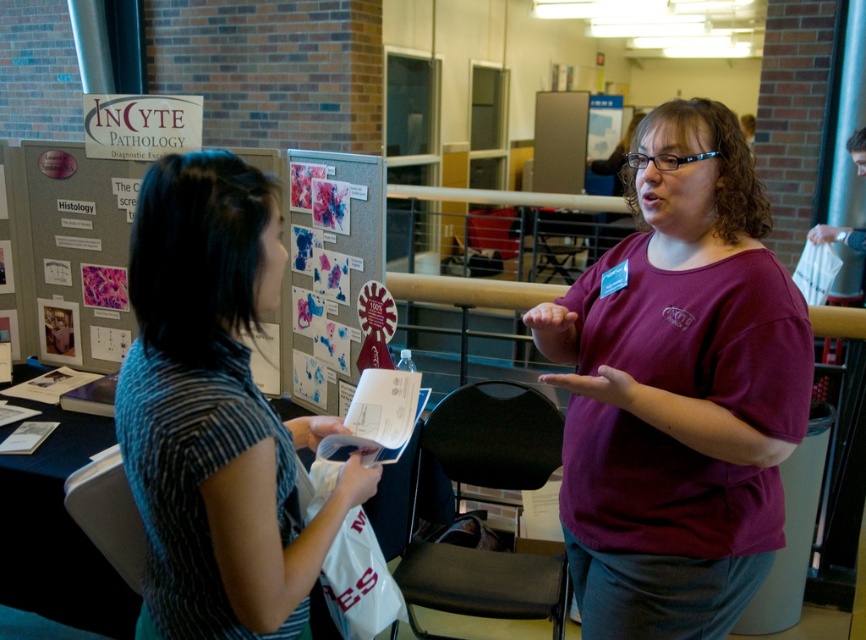
Question: From the image, what is the correct spatial relationship of striped fabric shirt at center in relation to watercolor paper poster at center?

Choices:
 (A) left
 (B) right

Answer: (B)

Question: Which point is closer to the camera taking this photo?

Choices:
 (A) (95, 170)
 (B) (225, 256)
 (C) (375, 186)

Answer: (B)

Question: Which point appears farthest from the camera in this image?

Choices:
 (A) (677, 225)
 (B) (104, 278)
 (C) (301, 333)
 (D) (173, 624)

Answer: (B)

Question: Which of these objects is positioned closest to the watercolor paper poster at center?

Choices:
 (A) maroon t-shirt at center
 (B) striped fabric shirt at center

Answer: (A)

Question: Does maroon t-shirt at center have a larger size compared to matte gray bulletin board at center?

Choices:
 (A) no
 (B) yes

Answer: (B)

Question: Can you confirm if maroon t-shirt at center is positioned to the right of matte gray bulletin board at center?

Choices:
 (A) yes
 (B) no

Answer: (A)